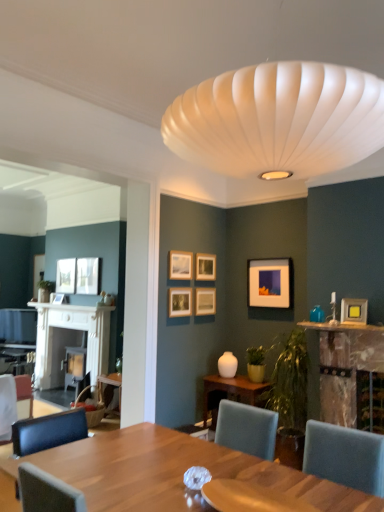
Question: Considering the relative sizes of matte wooden picture frame at upper center, which ranks as the 4th picture frame in back-to-front order, and teal glass vase at upper right in the image provided, is matte wooden picture frame at upper center, which ranks as the 4th picture frame in back-to-front order, smaller than teal glass vase at upper right?

Choices:
 (A) no
 (B) yes

Answer: (A)

Question: Considering the relative sizes of matte wooden picture frame at upper center, the third picture frame in the right-to-left sequence, and teal glass vase at upper right in the image provided, is matte wooden picture frame at upper center, the third picture frame in the right-to-left sequence, taller than teal glass vase at upper right?

Choices:
 (A) no
 (B) yes

Answer: (B)

Question: Is matte wooden picture frame at upper center, which ranks as the 4th picture frame in back-to-front order, beside teal glass vase at upper right?

Choices:
 (A) yes
 (B) no

Answer: (B)

Question: Does matte wooden picture frame at upper center, which ranks as the 4th picture frame in back-to-front order, appear on the right side of teal glass vase at upper right?

Choices:
 (A) yes
 (B) no

Answer: (B)

Question: Is matte wooden picture frame at upper center, which is the 6th picture frame from front to back, surrounding teal glass vase at upper right?

Choices:
 (A) yes
 (B) no

Answer: (B)

Question: Does matte wooden picture frame at upper center, the third picture frame in the right-to-left sequence, have a lesser width compared to teal glass vase at upper right?

Choices:
 (A) no
 (B) yes

Answer: (B)

Question: Can you confirm if teal glass vase at upper right is positioned to the right of white fabric chair at lower left?

Choices:
 (A) no
 (B) yes

Answer: (B)

Question: Is teal glass vase at upper right far from white fabric chair at lower left?

Choices:
 (A) no
 (B) yes

Answer: (B)

Question: Is the depth of teal glass vase at upper right greater than that of white fabric chair at lower left?

Choices:
 (A) yes
 (B) no

Answer: (B)

Question: Does teal glass vase at upper right have a greater width compared to white fabric chair at lower left?

Choices:
 (A) yes
 (B) no

Answer: (B)

Question: Considering the relative sizes of teal glass vase at upper right and white fabric chair at lower left in the image provided, is teal glass vase at upper right smaller than white fabric chair at lower left?

Choices:
 (A) yes
 (B) no

Answer: (A)

Question: Is teal glass vase at upper right at the left side of white fabric chair at lower left?

Choices:
 (A) no
 (B) yes

Answer: (A)

Question: Is matte black picture frame at left, placed as the 9th picture frame when sorted from front to back, shorter than teal glass vase at upper right?

Choices:
 (A) no
 (B) yes

Answer: (A)